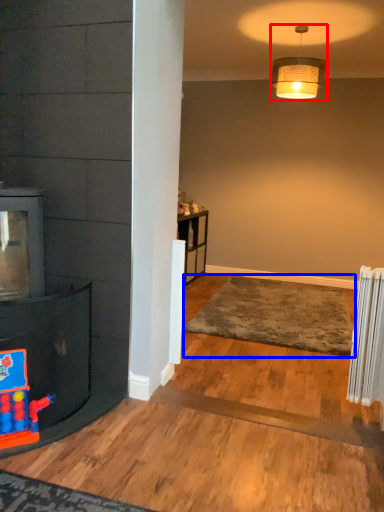
Question: Which of the following is the closest to the observer, lamp (highlighted by a red box) or plain (highlighted by a blue box)?

Choices:
 (A) lamp
 (B) plain

Answer: (B)